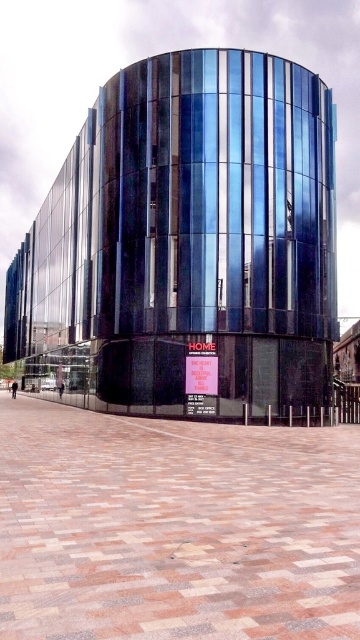
You are a visitor standing at the entrance of the modern building. You see a polished concrete plaza at center and a red plastic sign at center. Which object is wider?

The polished concrete plaza at center is wider than the red plastic sign at center.

You are standing in front of the modern building with a curved facade. You see a paved brick plaza at center and a red plastic sign at center. Which object is located to the left of the other?

The paved brick plaza at center is positioned on the left side of red plastic sign at center, so the paved brick plaza at center is to the left of the red plastic sign at center.

You are standing at the entrance of the building and want to reach the polished concrete plaza at center. Which direction should you walk to reach it?

Since the polished concrete plaza at center is located at point (186, 243), you should walk towards the center of the building to reach it.